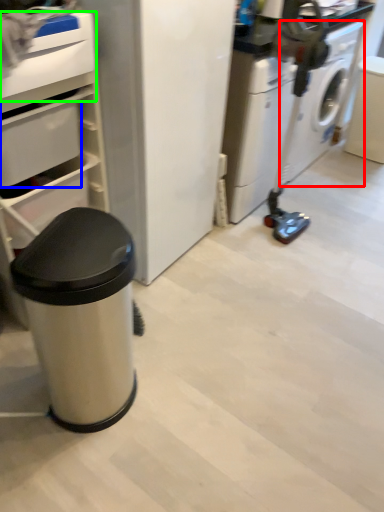
Question: Which is farther away from washing machine (highlighted by a red box)? drawer (highlighted by a blue box) or drawer (highlighted by a green box)?

Choices:
 (A) drawer
 (B) drawer

Answer: (B)